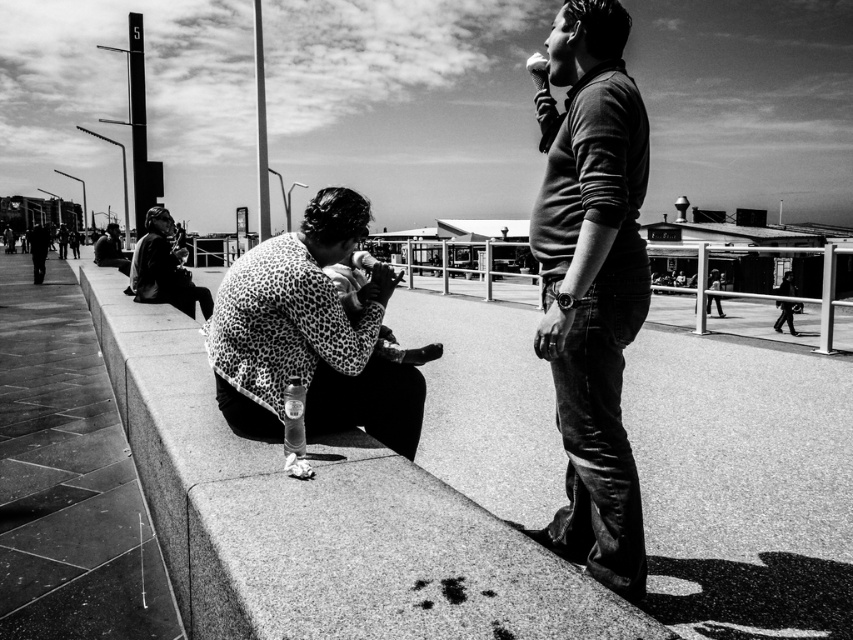
Question: Is granite ledge at lower left to the right of matte brown sweater at center from the viewer's perspective?

Choices:
 (A) yes
 (B) no

Answer: (B)

Question: Which point is closer to the camera taking this photo?

Choices:
 (A) (381, 365)
 (B) (149, 268)

Answer: (A)

Question: Based on their relative distances, which object is farther from the leopard print sweater at lower center?

Choices:
 (A) granite ledge at lower left
 (B) leopard print jacket at center

Answer: (B)

Question: Is matte brown sweater at center to the right of leopard print sweater at lower center from the viewer's perspective?

Choices:
 (A) yes
 (B) no

Answer: (A)

Question: Does granite ledge at lower left have a smaller size compared to leopard print jacket at center?

Choices:
 (A) no
 (B) yes

Answer: (B)

Question: Which of the following is the closest to the observer?

Choices:
 (A) (589, 413)
 (B) (265, 404)
 (C) (160, 225)
 (D) (316, 566)

Answer: (D)